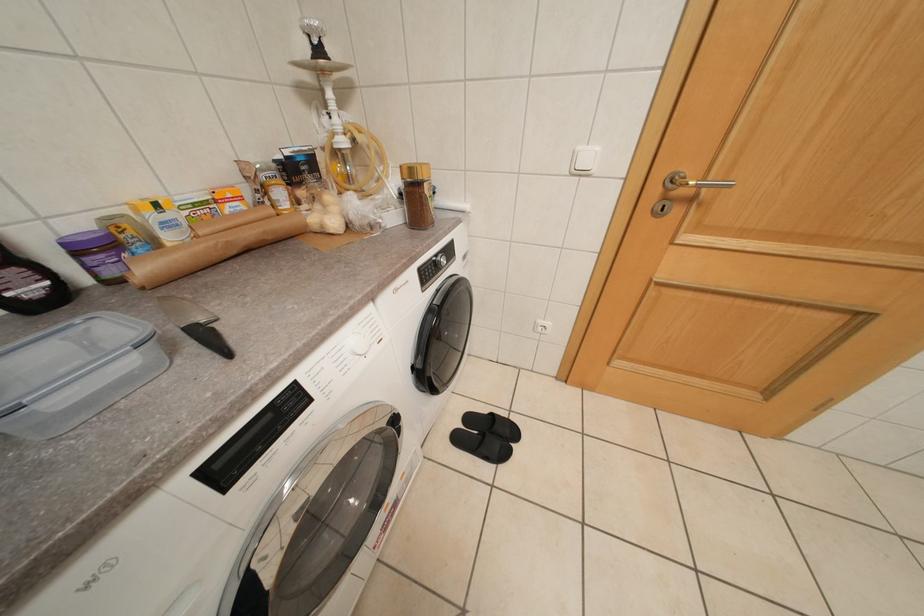
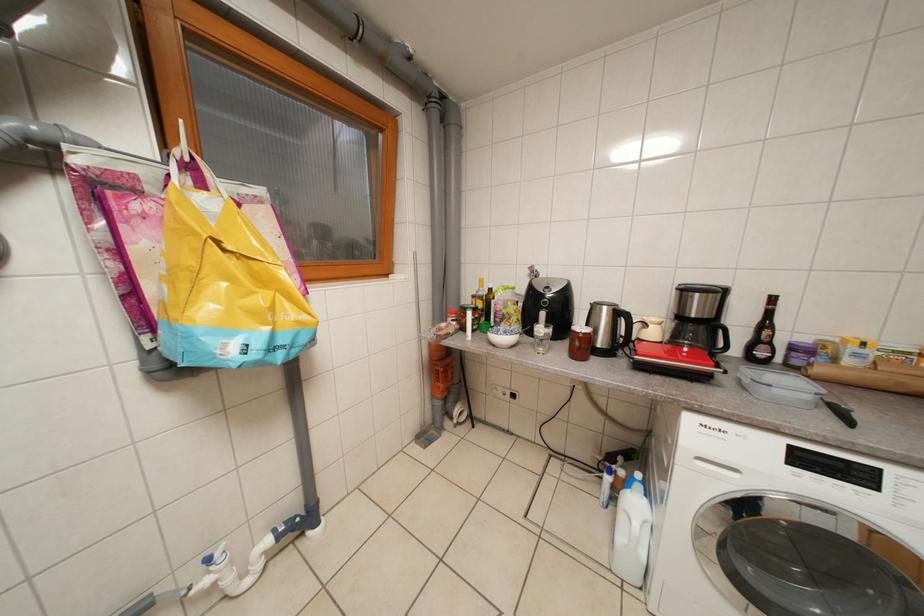
The images are taken continuously from a first-person perspective. In which direction is your viewpoint rotating?

The camera's rotation is toward left-down.